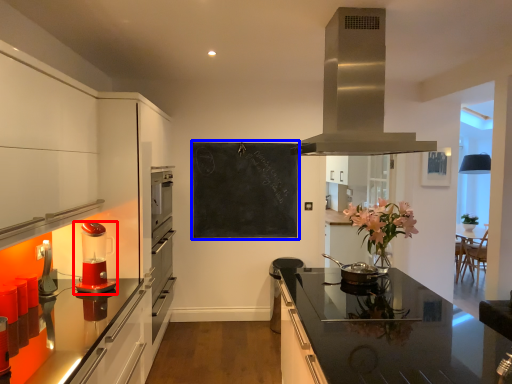
Question: Which of the following is the farthest to the observer, kitchen appliance (highlighted by a red box) or bulletin board (highlighted by a blue box)?

Choices:
 (A) kitchen appliance
 (B) bulletin board

Answer: (B)